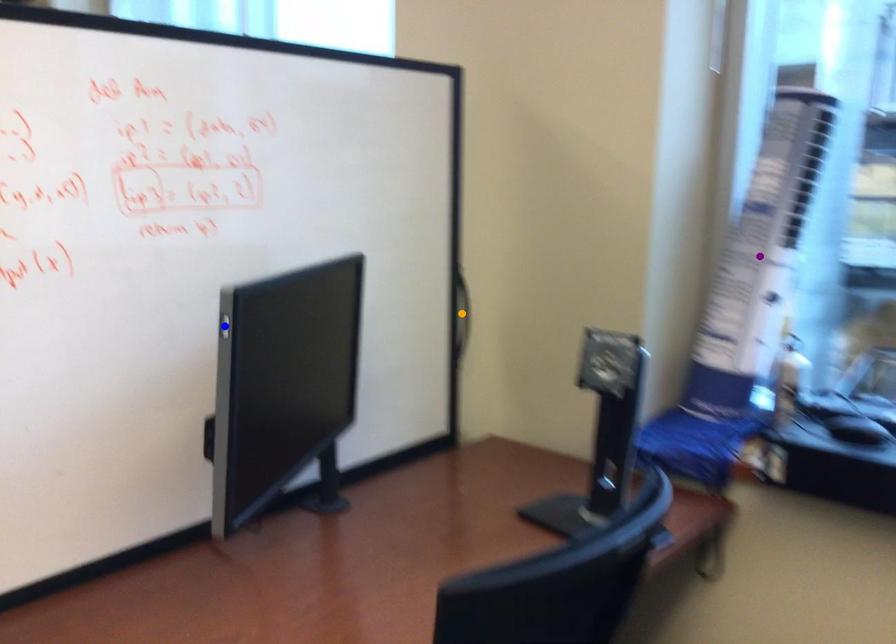
Order these from nearest to farthest:
- blue point
- purple point
- orange point

blue point < purple point < orange point